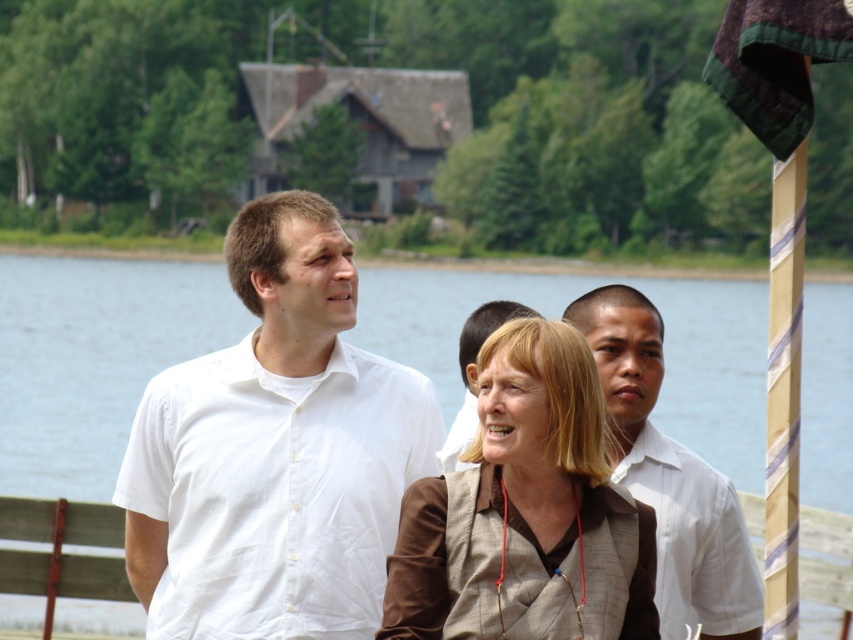
Who is lower down, white cotton shirt at center or white striped shirt at center?

Positioned lower is white striped shirt at center.

Where is `white cotton shirt at center`? white cotton shirt at center is located at coordinates (276, 451).

Who is positioned more to the left, white cotton shirt at center or transparent water at center?

From the viewer's perspective, transparent water at center appears more on the left side.

Between white cotton shirt at center and transparent water at center, which one appears on the right side from the viewer's perspective?

white cotton shirt at center

Describe the element at coordinates (276, 451) in the screenshot. I see `white cotton shirt at center` at that location.

Locate an element on the screen. The width and height of the screenshot is (853, 640). white cotton shirt at center is located at coordinates click(276, 451).

Who is positioned more to the left, brown textured vest at center or white shirt at center?

From the viewer's perspective, white shirt at center appears more on the left side.

Is brown textured vest at center to the left of white shirt at center from the viewer's perspective?

Incorrect, brown textured vest at center is not on the left side of white shirt at center.

Measure the distance between point (572, 368) and camera.

They are 42.84 feet apart.

Locate an element on the screen. Image resolution: width=853 pixels, height=640 pixels. brown textured vest at center is located at coordinates (526, 513).